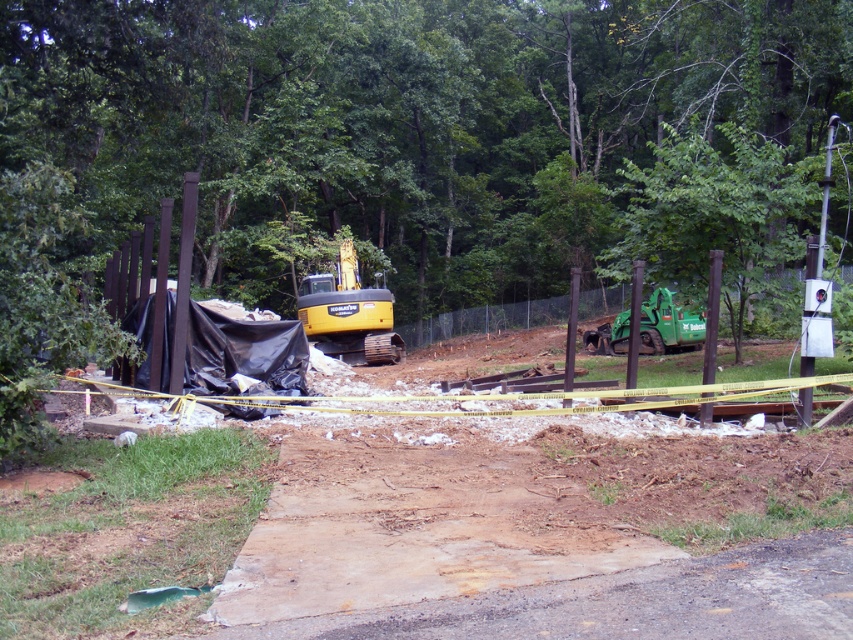
What are the coordinates of the green leafy tree at upper center in the image?

The green leafy tree at upper center is located at coordinates point (399, 122).

You are a construction worker planning to move a heavy equipment from the yellow rubber excavator at center to the green leafy tree at upper center. Which object would require more space to maneuver around due to its size?

The green leafy tree at upper center has a larger size compared to the yellow rubber excavator at center, so it would require more space to maneuver around.

You are a construction worker standing at the edge of the construction site. You need to move a heavy tool from the green leafy tree at upper center to the yellow rubber excavator at center. Which object should you pass closer to first?

The green leafy tree at upper center is closer to the viewer than the yellow rubber excavator at center, so you should pass closer to the green leafy tree at upper center first.